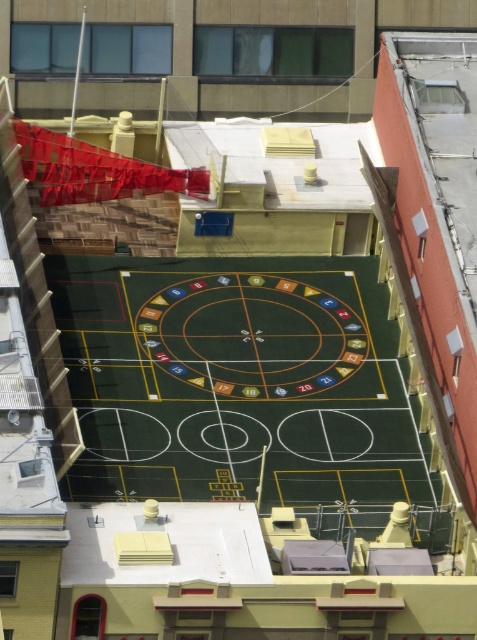
Question: Which object is closer to the camera taking this photo?

Choices:
 (A) green rubber basketball court at center
 (B) green felt roulette at center

Answer: (A)

Question: Is green rubber basketball court at center thinner than green felt roulette at center?

Choices:
 (A) yes
 (B) no

Answer: (B)

Question: From the image, what is the correct spatial relationship of green rubber basketball court at center in relation to green felt roulette at center?

Choices:
 (A) below
 (B) above

Answer: (A)

Question: Which point is closer to the camera taking this photo?

Choices:
 (A) (90, 481)
 (B) (207, 307)

Answer: (A)

Question: Does green rubber basketball court at center have a larger size compared to green felt roulette at center?

Choices:
 (A) yes
 (B) no

Answer: (A)